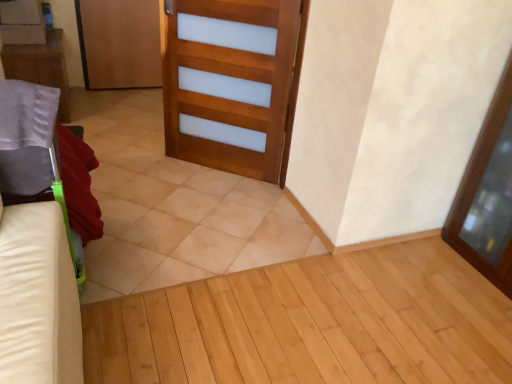
Question: Does beige tile at center appear on the right side of matte gray pillow at left?

Choices:
 (A) no
 (B) yes

Answer: (B)

Question: Is beige tile at center bigger than matte gray pillow at left?

Choices:
 (A) no
 (B) yes

Answer: (B)

Question: Is beige tile at center in contact with matte gray pillow at left?

Choices:
 (A) no
 (B) yes

Answer: (A)

Question: Is beige tile at center facing towards matte gray pillow at left?

Choices:
 (A) yes
 (B) no

Answer: (B)

Question: Are beige tile at center and matte gray pillow at left located far from each other?

Choices:
 (A) yes
 (B) no

Answer: (A)

Question: From their relative heights in the image, would you say wooden door at upper left, which is the second door from right to left, is taller or shorter than beige tile at center?

Choices:
 (A) tall
 (B) short

Answer: (A)

Question: Considering the positions of wooden door at upper left, acting as the second door starting from the front, and beige tile at center in the image, is wooden door at upper left, acting as the second door starting from the front, wider or thinner than beige tile at center?

Choices:
 (A) thin
 (B) wide

Answer: (A)

Question: Considering the positions of point (97, 13) and point (237, 203), is point (97, 13) closer or farther from the camera than point (237, 203)?

Choices:
 (A) closer
 (B) farther

Answer: (B)

Question: Relative to beige tile at center, is wooden door at upper left, which ranks as the 2th door in bottom-to-top order, in front or behind?

Choices:
 (A) behind
 (B) front

Answer: (A)

Question: Is point (125, 39) closer or farther from the camera than point (33, 76)?

Choices:
 (A) closer
 (B) farther

Answer: (B)

Question: Would you say wooden door at upper left, which is counted as the first door, starting from the back, is inside or outside matte gray pillow at left?

Choices:
 (A) inside
 (B) outside

Answer: (B)

Question: Considering the positions of wooden door at upper left, which is counted as the 1th door, starting from the top, and matte gray pillow at left in the image, is wooden door at upper left, which is counted as the 1th door, starting from the top, taller or shorter than matte gray pillow at left?

Choices:
 (A) short
 (B) tall

Answer: (B)

Question: From the image's perspective, relative to matte gray pillow at left, is wooden door at upper left, the first door from the left, above or below?

Choices:
 (A) above
 (B) below

Answer: (A)

Question: From their relative heights in the image, would you say wooden door at center, which ranks as the first door in front-to-back order, is taller or shorter than transparent glass screen door at right?

Choices:
 (A) tall
 (B) short

Answer: (B)

Question: Looking at the image, does wooden door at center, the 2th door positioned from the back, seem bigger or smaller compared to transparent glass screen door at right?

Choices:
 (A) small
 (B) big

Answer: (A)